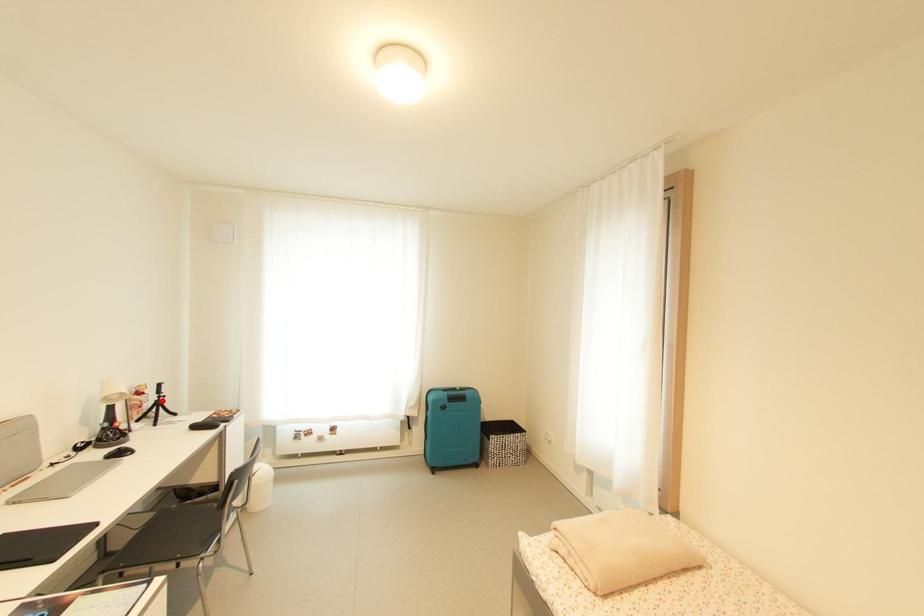
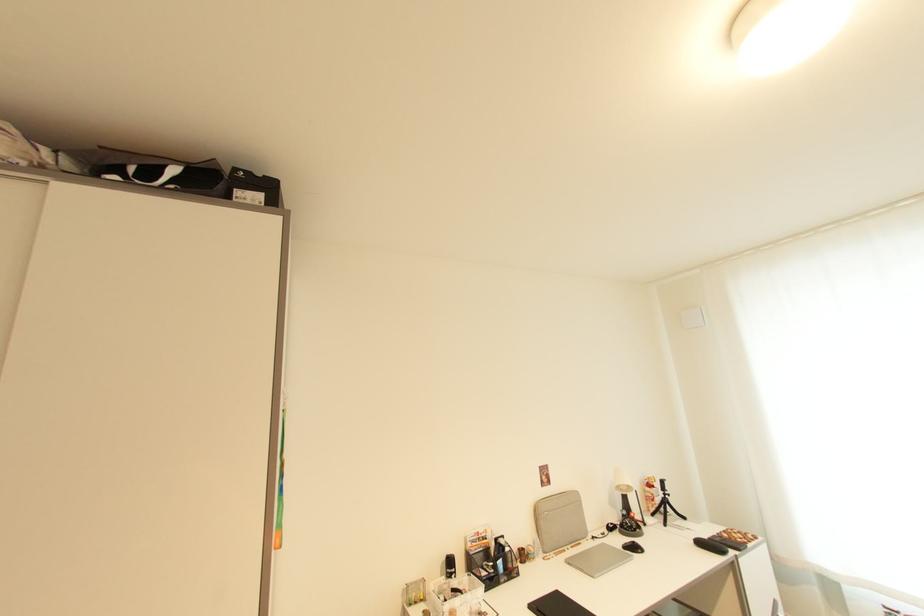
Where in the second image is the point corresponding to the highlighted location from the first image?

(669, 498)